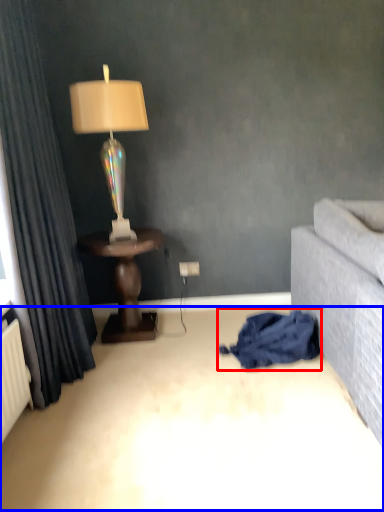
Question: Among these objects, which one is nearest to the camera, blanket (highlighted by a red box) or plain (highlighted by a blue box)?

Choices:
 (A) blanket
 (B) plain

Answer: (B)